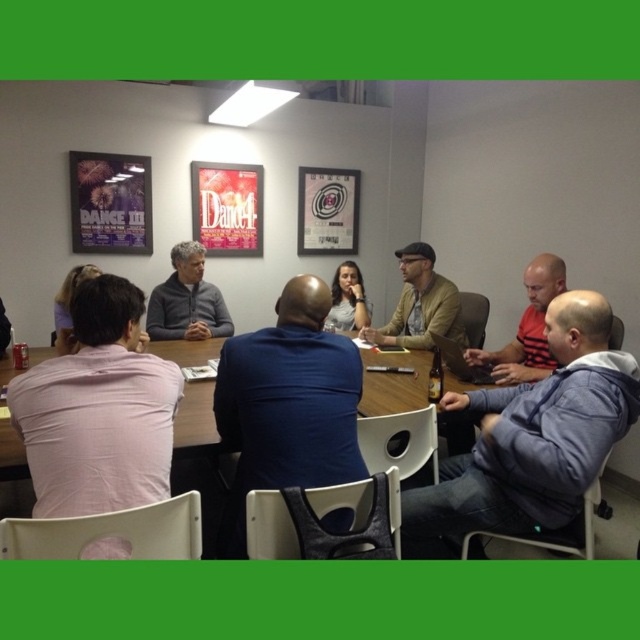
You are standing 1.5 meters away from the table in the meeting room. There is a point marked at coordinates point [241,534] on the table. Can you reach this point without moving closer to the table?

The distance of point [241,534] from viewer is 1.63 meters. Since you are currently 1.5 meters away from the table, you are closer than the point, so you need to move back to reach it.

What is the color of the shirt worn by the person sitting at the coordinates point (x=99, y=410)?

The pink cotton shirt at left is located at point (x=99, y=410), so the color is pink.

You are standing at the entrance of the meeting room and want to locate the pink cotton shirt at left. Based on the coordinates provided, where would you look relative to the room?

The pink cotton shirt at left is located at the coordinates 0.642 on the x axis and 0.155 on the y axis, so you should look to the right side of the room and slightly forward from the entrance.